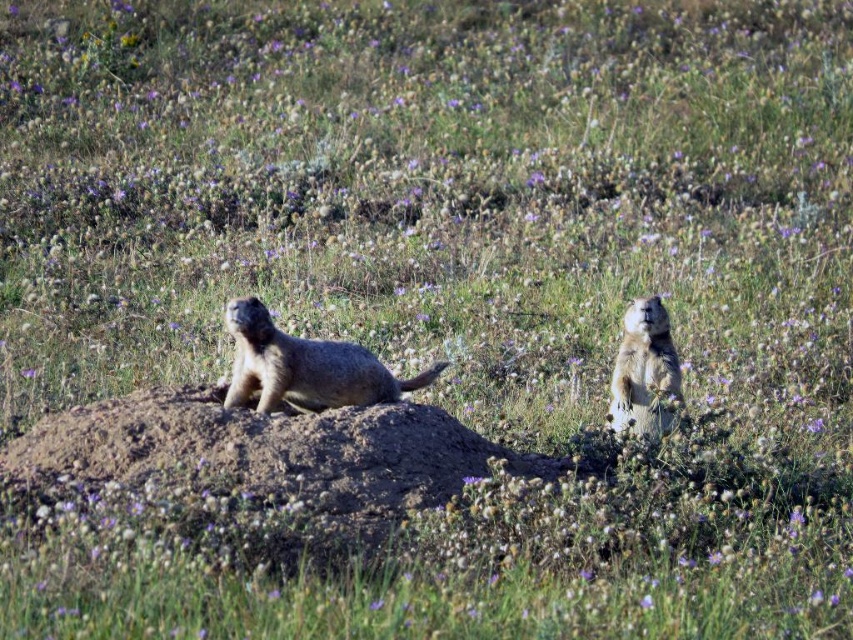
Does brown dirt mound at center have a smaller size compared to fuzzy brown ground squirrel at center?

Actually, brown dirt mound at center might be larger than fuzzy brown ground squirrel at center.

Which of these two, brown dirt mound at center or fuzzy brown ground squirrel at center, stands taller?

Standing taller between the two is brown dirt mound at center.

You are a GUI agent. You are given a task and a screenshot of the screen. Output one action in this format:
    pyautogui.click(x=<x>, y=<y>)
    Task: Click on the brown dirt mound at center
    
    Given the screenshot: What is the action you would take?
    pyautogui.click(x=256, y=468)

Does fuzzy brown ground squirrel at center appear on the right side of furry beige groundhog at right?

Incorrect, fuzzy brown ground squirrel at center is not on the right side of furry beige groundhog at right.

Which is behind, point (357, 403) or point (679, 365)?

Point (679, 365)

Identify the location of fuzzy brown ground squirrel at center. (305, 365).

Who is shorter, brown dirt mound at center or furry beige groundhog at right?

Standing shorter between the two is brown dirt mound at center.

Identify the location of brown dirt mound at center. (256, 468).

The width and height of the screenshot is (853, 640). Identify the location of brown dirt mound at center. (256, 468).